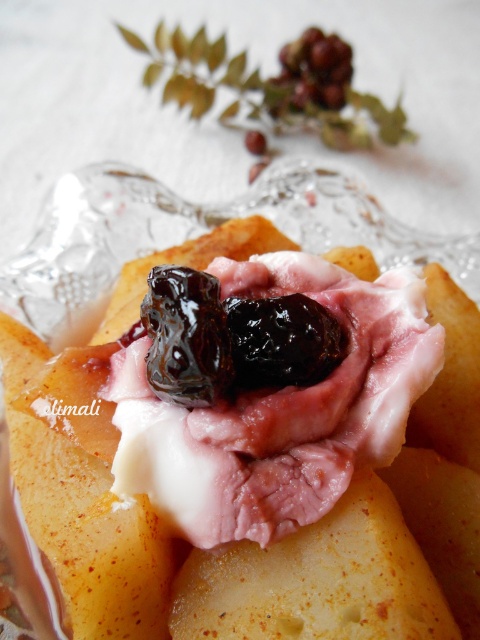
Question: Does dark glossy plum at center have a larger size compared to ripe purple grapes at upper center?

Choices:
 (A) no
 (B) yes

Answer: (A)

Question: Considering the real-world distances, which object is closest to the dark glossy plum at center?

Choices:
 (A) ripe purple grapes at upper center
 (B) pink creamy ham at center

Answer: (B)

Question: Is pink creamy ham at center bigger than dark glossy plum at center?

Choices:
 (A) yes
 (B) no

Answer: (A)

Question: Estimate the real-world distances between objects in this image. Which object is closer to the pink creamy ham at center?

Choices:
 (A) ripe purple grapes at upper center
 (B) dark glossy plum at center

Answer: (B)

Question: Is pink creamy ham at center positioned at the back of dark glossy plum at center?

Choices:
 (A) no
 (B) yes

Answer: (A)

Question: Estimate the real-world distances between objects in this image. Which object is closer to the dark glossy plum at center?

Choices:
 (A) ripe purple grapes at upper center
 (B) pink creamy ham at center

Answer: (B)